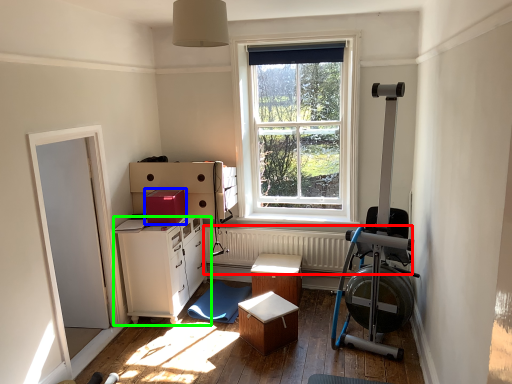
Question: Considering the real-world distances, which object is farthest from radiator (highlighted by a red box)? cardboard box (highlighted by a blue box) or cabinetry (highlighted by a green box)?

Choices:
 (A) cardboard box
 (B) cabinetry

Answer: (A)